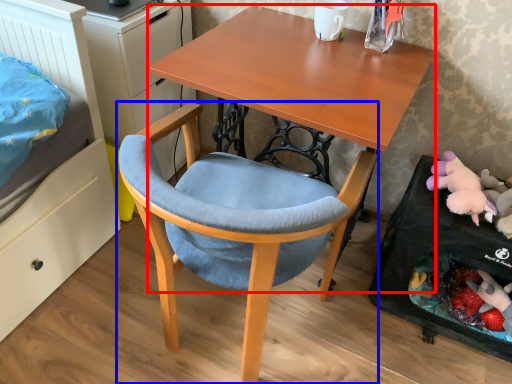
Question: Which point is further to the camera, desk (highlighted by a red box) or chair (highlighted by a blue box)?

Choices:
 (A) desk
 (B) chair

Answer: (A)